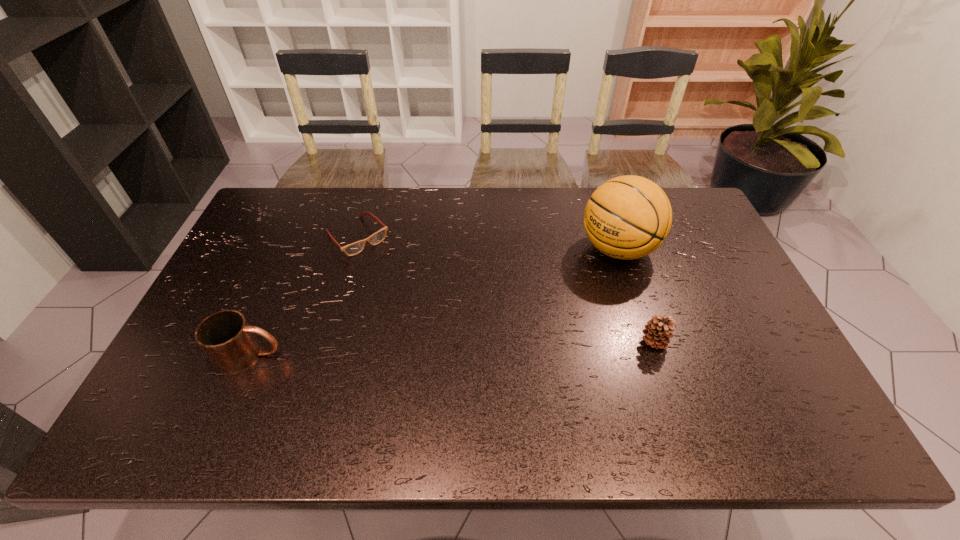
In order to click on vacant area that lies between the tallest object and the pinecone in this screenshot , I will do `click(636, 295)`.

Identify which object is the second closest to the spectacles. Please provide its 2D coordinates. Your answer should be formatted as a tuple, i.e. [(x, y)], where the tuple contains the x and y coordinates of a point satisfying the conditions above.

[(627, 217)]

Where is `object that ranks as the third closest to the mug`? This screenshot has width=960, height=540. object that ranks as the third closest to the mug is located at coordinates (657, 330).

Where is `free spot that satisfies the following two spatial constraints: 1. on the front side of the basketball; 2. on the right side of the pinecone`? The width and height of the screenshot is (960, 540). free spot that satisfies the following two spatial constraints: 1. on the front side of the basketball; 2. on the right side of the pinecone is located at coordinates (648, 342).